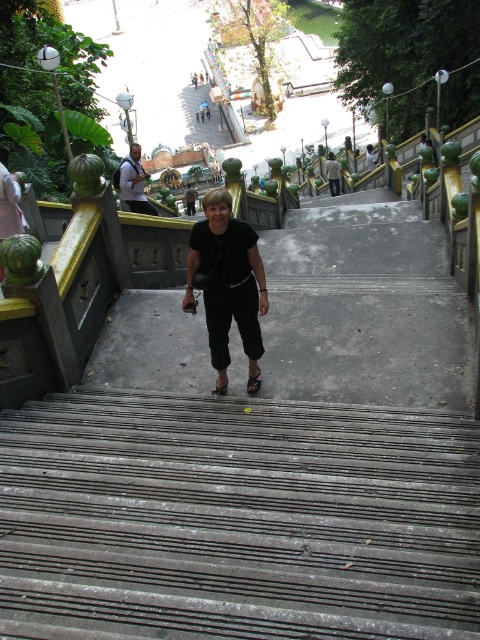
Question: Can you confirm if rusty metal stairs at center is positioned above matte black hair at center?

Choices:
 (A) no
 (B) yes

Answer: (A)

Question: Can you confirm if rusty metal stairs at center is positioned to the right of blonde hair at center?

Choices:
 (A) yes
 (B) no

Answer: (A)

Question: Considering the relative positions of blonde hair at center and matte black hair at center in the image provided, where is blonde hair at center located with respect to matte black hair at center?

Choices:
 (A) right
 (B) left

Answer: (A)

Question: Which object is the closest to the matte black hair at center?

Choices:
 (A) blonde hair at center
 (B) rusty metal stairs at center

Answer: (A)

Question: Estimate the real-world distances between objects in this image. Which object is closer to the blonde hair at center?

Choices:
 (A) matte black hair at center
 (B) rusty metal stairs at center

Answer: (B)

Question: Among these points, which one is farthest from the camera?

Choices:
 (A) (222, 220)
 (B) (86, 531)
 (C) (130, 145)

Answer: (C)